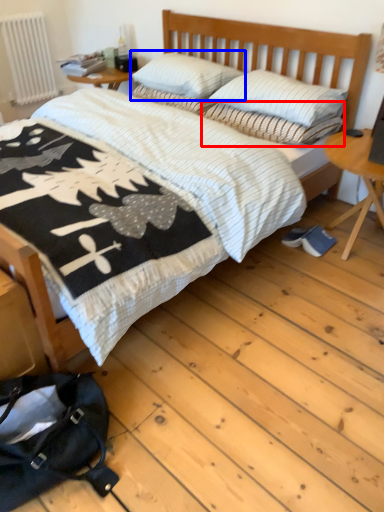
Question: Among these objects, which one is farthest to the camera, pillow (highlighted by a red box) or pillow (highlighted by a blue box)?

Choices:
 (A) pillow
 (B) pillow

Answer: (B)